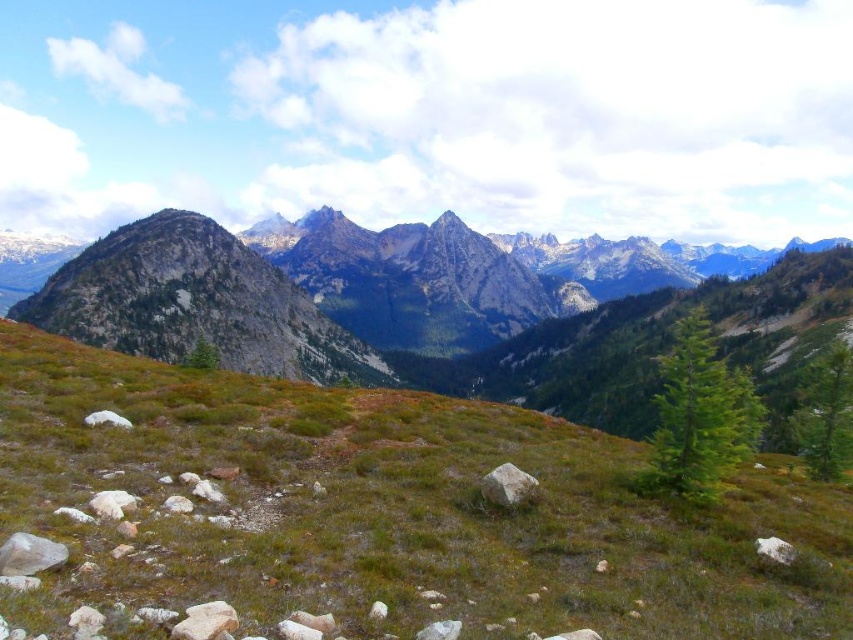
Between green grassy at center and white smooth rock at lower left, which one appears on the right side from the viewer's perspective?

green grassy at center is more to the right.

Find the location of a particular element. This screenshot has width=853, height=640. green grassy at center is located at coordinates (383, 513).

This screenshot has width=853, height=640. I want to click on green grassy at center, so click(x=383, y=513).

Which of these two, gray rough rock at lower left or white smooth rock at lower left, stands taller?

gray rough rock at lower left is taller.

Is gray rough rock at lower left below white smooth rock at lower left?

Correct, gray rough rock at lower left is located below white smooth rock at lower left.

This screenshot has width=853, height=640. I want to click on gray rough rock at lower left, so click(28, 554).

Where is `gray rough rock at lower left`? gray rough rock at lower left is located at coordinates (28, 554).

Does gray rough rock at lower left appear under white smooth rock at lower right?

No.

Which is behind, point (54, 566) or point (775, 556)?

Positioned behind is point (775, 556).

Who is more distant from viewer, (44,556) or (784,563)?

Positioned behind is point (784,563).

This screenshot has height=640, width=853. Find the location of `gray rough rock at lower left`. gray rough rock at lower left is located at coordinates (28, 554).